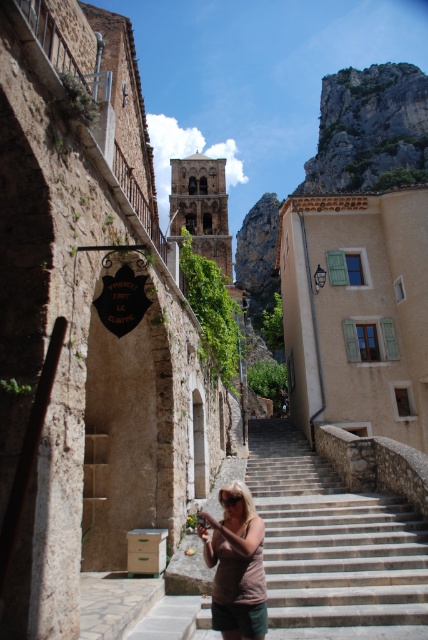
Question: Considering the relative positions of smooth stone stairs at center and brown cotton shirt at center in the image provided, where is smooth stone stairs at center located with respect to brown cotton shirt at center?

Choices:
 (A) above
 (B) below

Answer: (B)

Question: Is smooth stone stairs at center thinner than brown cotton shirt at center?

Choices:
 (A) yes
 (B) no

Answer: (B)

Question: Which of the following is the closest to the observer?

Choices:
 (A) (401, 529)
 (B) (243, 512)

Answer: (B)

Question: Which point is farther to the camera?

Choices:
 (A) (216, 570)
 (B) (265, 486)

Answer: (B)

Question: Which point appears closest to the camera in this image?

Choices:
 (A) (270, 592)
 (B) (249, 632)

Answer: (B)

Question: Does smooth stone stairs at center have a greater width compared to brown cotton shirt at center?

Choices:
 (A) yes
 (B) no

Answer: (A)